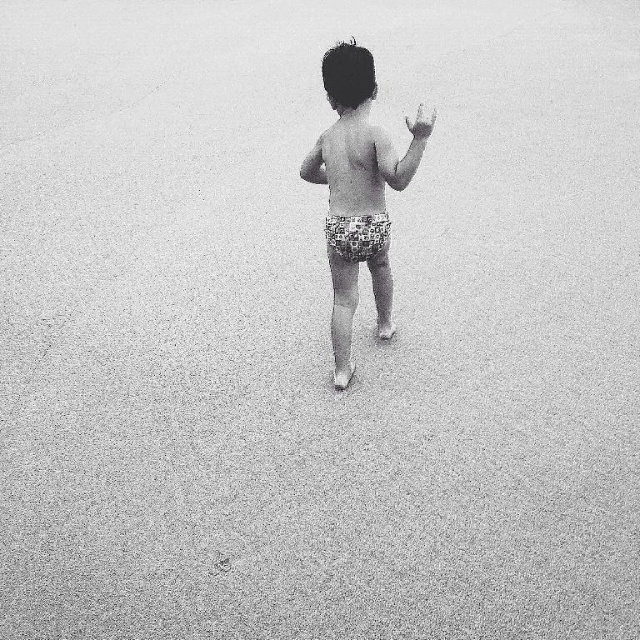
The image size is (640, 640). Describe the element at coordinates (355, 195) in the screenshot. I see `printed fabric shorts at center` at that location.

Between point (342, 64) and point (352, 198), which one is positioned behind?

Point (352, 198)

Is point (324, 81) positioned behind point (349, 209)?

No, (324, 81) is closer to viewer.

At what (x,y) coordinates should I click in order to perform the action: click on printed fabric shorts at center. Please return your answer as a coordinate pair (x, y). The image size is (640, 640). Looking at the image, I should click on click(355, 195).

Does point (321, 152) come in front of point (408, 122)?

No, (321, 152) is further to viewer.

Image resolution: width=640 pixels, height=640 pixels. What do you see at coordinates (353, 164) in the screenshot? I see `smooth skin torso at center` at bounding box center [353, 164].

Locate an element on the screen. Image resolution: width=640 pixels, height=640 pixels. smooth skin torso at center is located at coordinates [353, 164].

Measure the distance between printed fabric shorts at center and smooth skin hand at upper right.

printed fabric shorts at center is 71.75 centimeters from smooth skin hand at upper right.

Does point (394, 172) come behind point (420, 106)?

Yes, it is.

Is point (349, 189) positioned in front of point (417, 131)?

No, it is behind (417, 131).

This screenshot has height=640, width=640. Find the location of `printed fabric shorts at center`. printed fabric shorts at center is located at coordinates (355, 195).